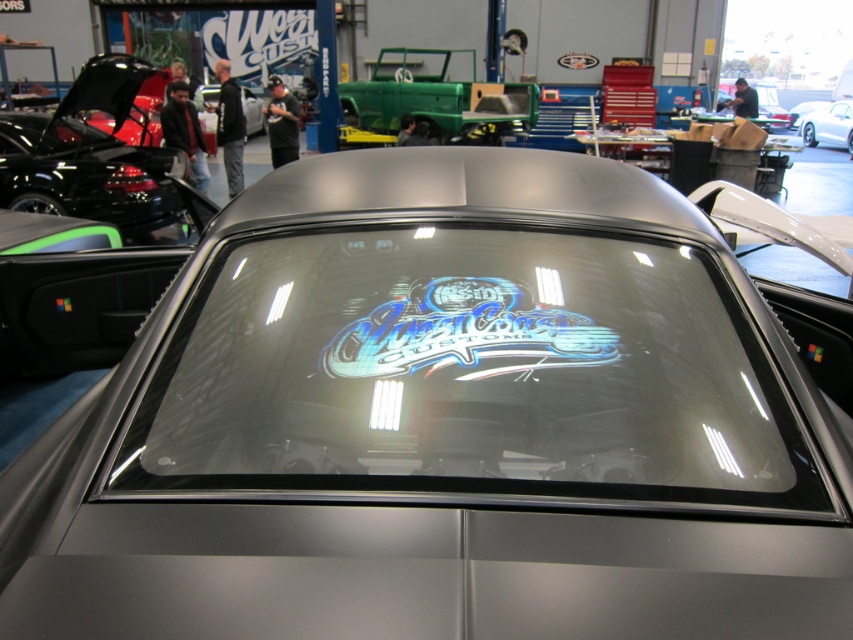
You are a designer who wants to create a scale model of the satin silver car at center. You need to know the relative size of the shiny metallic logo at center compared to the car. Is the logo smaller or larger than the car?

The shiny metallic logo at center is smaller than the satin silver car at center because its width is less than the car.

You are standing in the car showroom and want to take a photo of the two points mentioned. Which point, point (373, 356) or point (247, 109), will appear larger in your photo?

Point (373, 356) is closer to the camera than point (247, 109), so it will appear larger in the photo.

You are a customer at the car showroom and want to see the logo on the car. Which car should you look at, the shiny metallic logo at center or the matte black car at center?

The shiny metallic logo at center is positioned under the matte black car at center, so you should look at the matte black car at center to see the logo.